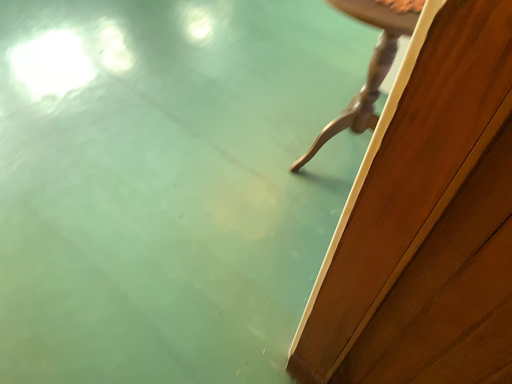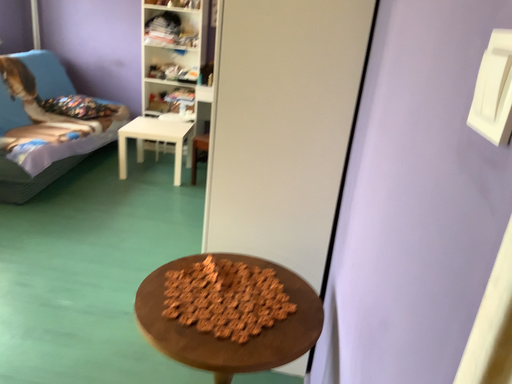
Question: Which way did the camera rotate in the video?

Choices:
 (A) rotated left
 (B) rotated right

Answer: (B)